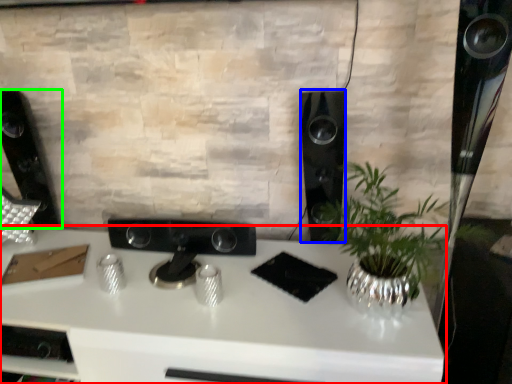
Question: Which is farther away from desk (highlighted by a red box)? speaker (highlighted by a blue box) or speaker (highlighted by a green box)?

Choices:
 (A) speaker
 (B) speaker

Answer: (B)